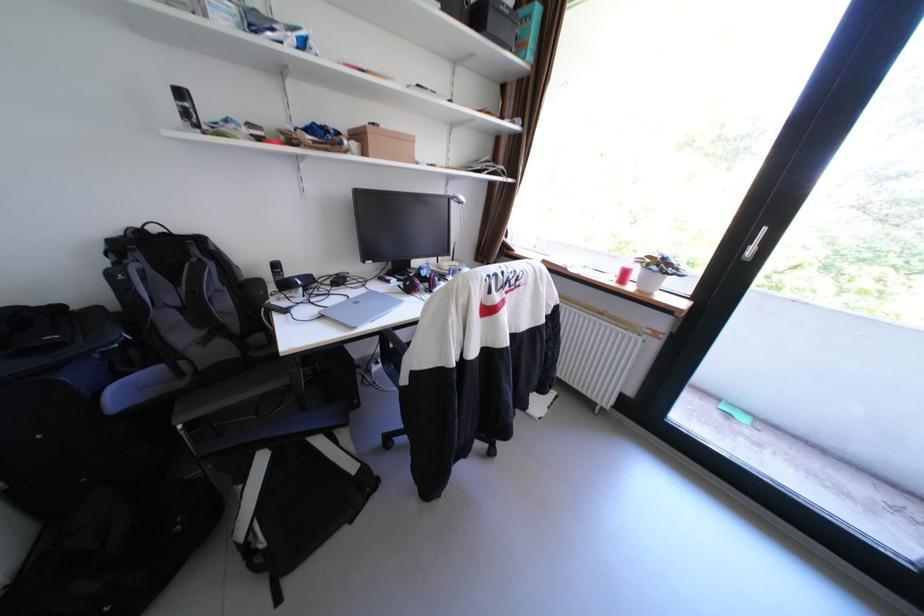
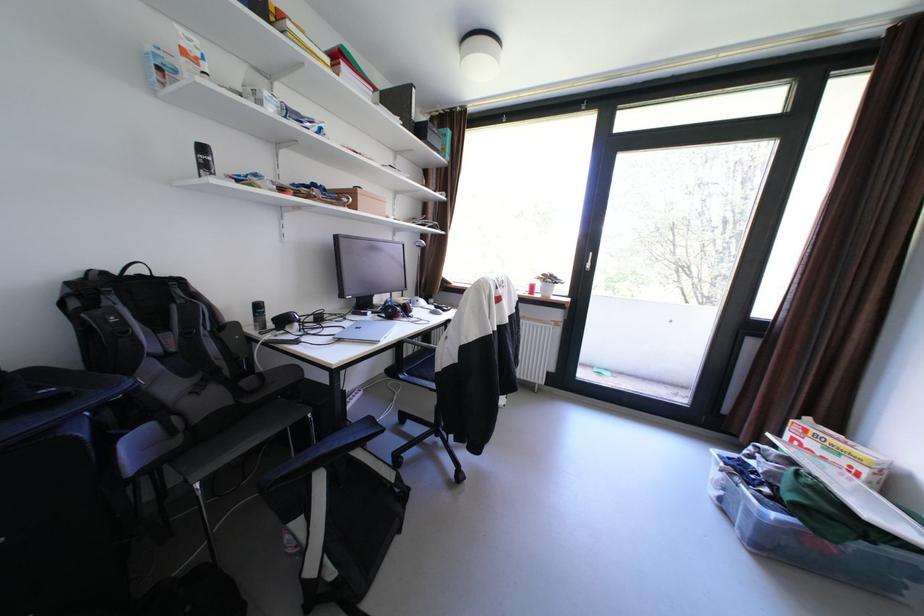
Question: The camera is either moving clockwise (left) or counter-clockwise (right) around the object. The first image is from the beginning of the video and the second image is from the end. Is the camera moving left or right when shooting the video?

Choices:
 (A) Left
 (B) Right

Answer: (A)